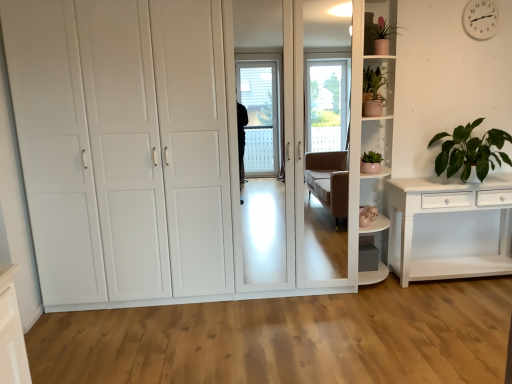
Find the location of `space that is in front of white glossy cupboard at center`. space that is in front of white glossy cupboard at center is located at coordinates (211, 341).